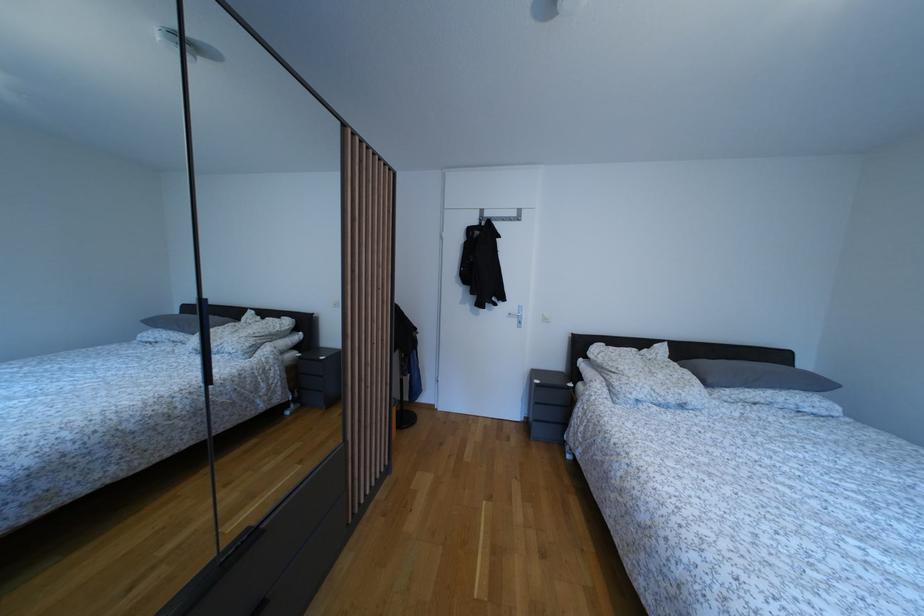
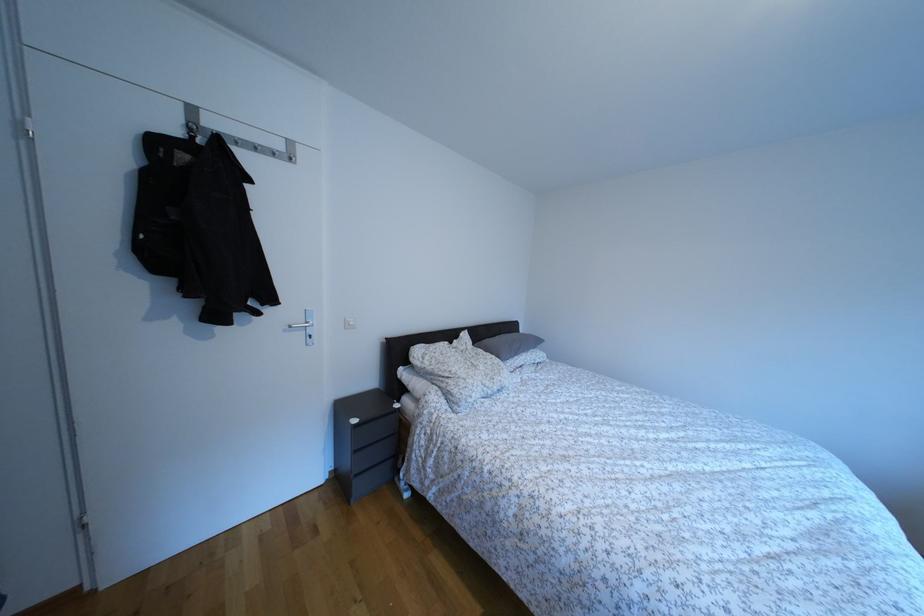
Find the pixel in the second image that matches [521,220] in the first image.

(286, 152)